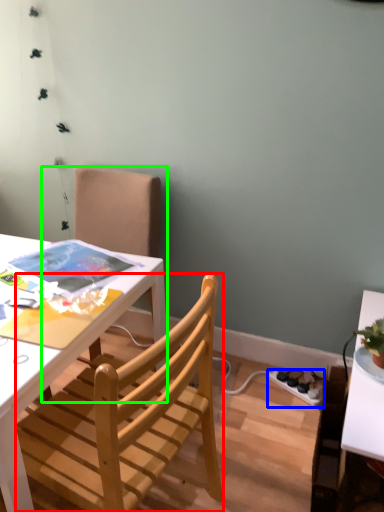
Question: Estimate the real-world distances between objects in this image. Which object is closer to chair (highlighted by a red box), power outlet (highlighted by a blue box) or chair (highlighted by a green box)?

Choices:
 (A) power outlet
 (B) chair

Answer: (B)